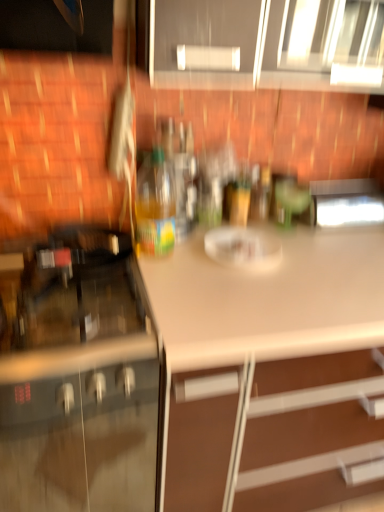
I want to click on vacant area located to the right-hand side of translucent plastic bottle at center, so click(x=202, y=264).